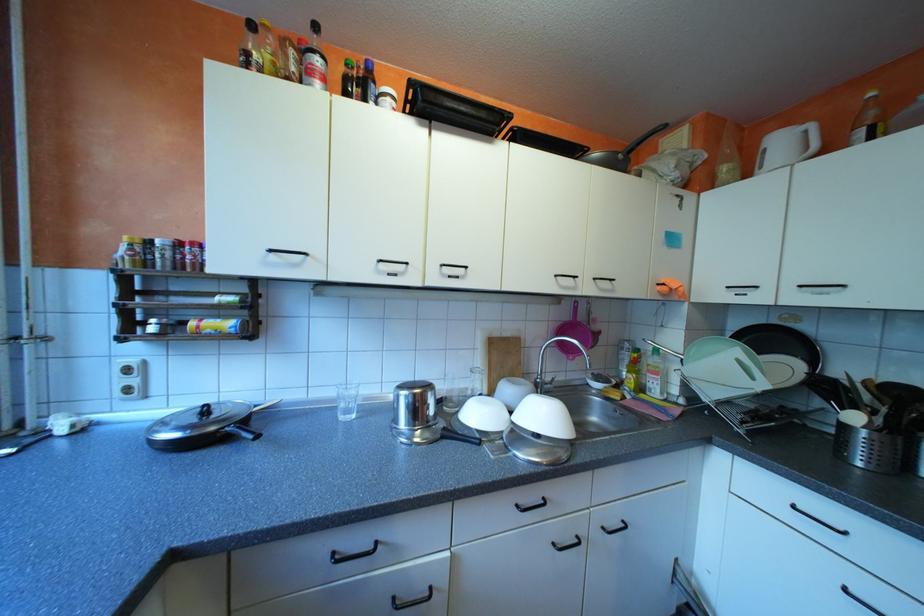
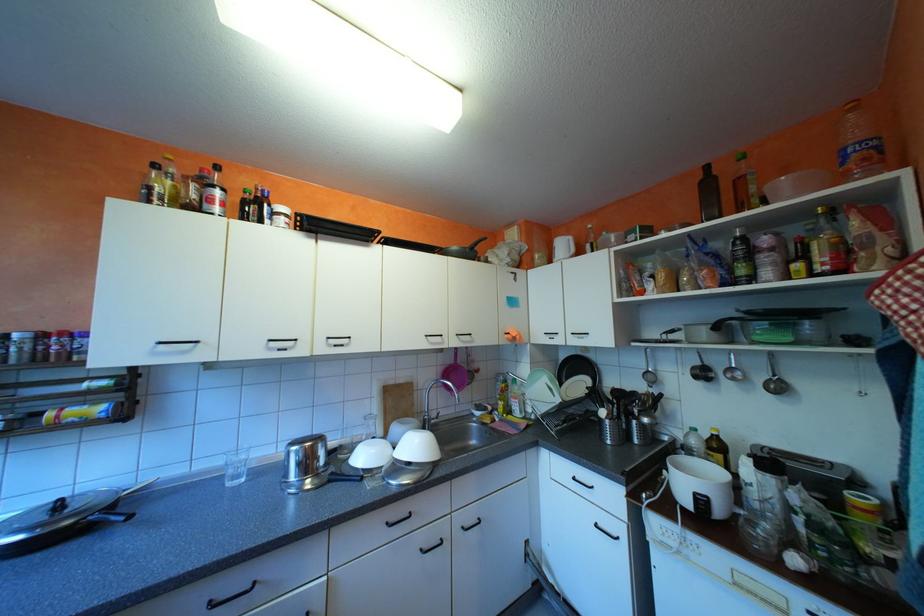
The point at (353, 416) is marked in the first image. Where is the corresponding point in the second image?

(239, 483)